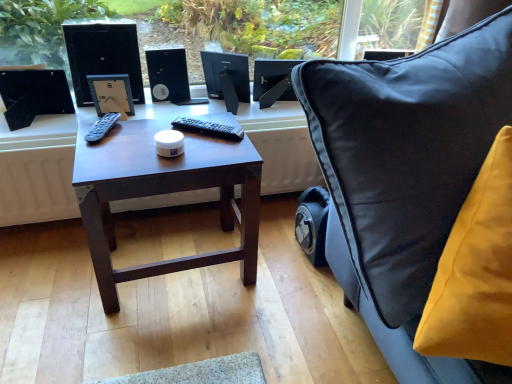
Where is `vacant region under dark wood table at center (from a real-world perspective)`? vacant region under dark wood table at center (from a real-world perspective) is located at coordinates (175, 256).